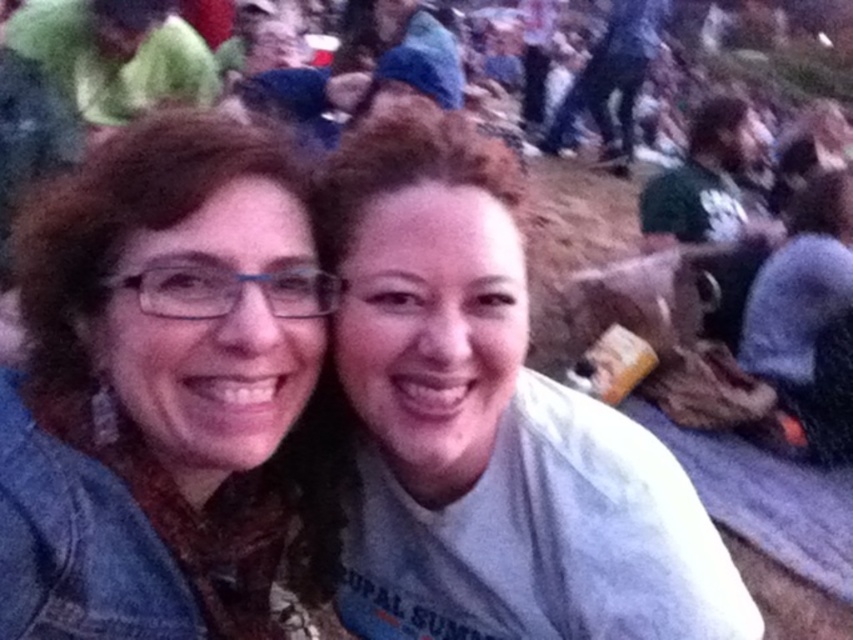
You are a photographer trying to adjust the lighting for a portrait of the two people in the image. You need to ensure that the matte blue jacket at left and the gray cotton shirt at center are both well lit. Since the lighting is currently uneven, which object should you focus on first to balance the exposure?

The matte blue jacket at left has a lesser height compared to gray cotton shirt at center. Therefore, you should focus on balancing the exposure for the matte blue jacket at left first because it is smaller in size and might be receiving less light due to its position.